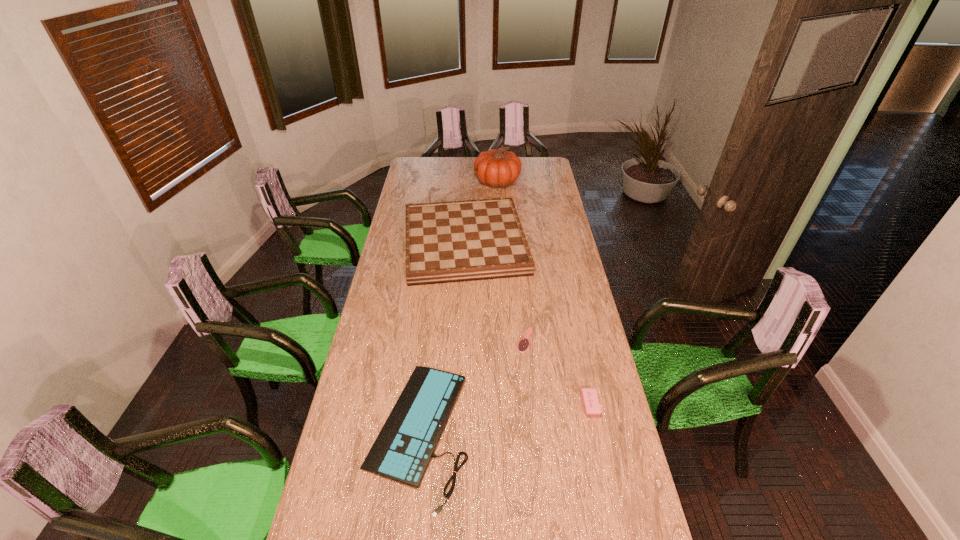
Find the location of a particular element. vacant space located on the face of the farthest object is located at coordinates (463, 181).

I want to click on free space located on the face of the farthest object, so click(410, 181).

I want to click on free space located 0.100m on the right of the second tallest object, so click(x=549, y=243).

You are a GUI agent. You are given a task and a screenshot of the screen. Output one action in this format:
    pyautogui.click(x=<x>, y=<y>)
    Task: Click on the vacant space positioned on the back of the eraser
    This screenshot has width=960, height=540.
    Given the screenshot: What is the action you would take?
    pyautogui.click(x=582, y=369)

Where is `vacant space located 0.330m on the back of the computer keyboard`? vacant space located 0.330m on the back of the computer keyboard is located at coordinates (433, 305).

The image size is (960, 540). Find the location of `vacant space situated on the left of the hairbrush`. vacant space situated on the left of the hairbrush is located at coordinates (473, 340).

The width and height of the screenshot is (960, 540). Find the location of `object present at the far edge`. object present at the far edge is located at coordinates (496, 168).

Locate an element on the screen. The image size is (960, 540). gameboard that is at the left edge is located at coordinates (457, 241).

You are a GUI agent. You are given a task and a screenshot of the screen. Output one action in this format:
    pyautogui.click(x=<x>, y=<y>)
    Task: Click on the computer keyboard situated at the left edge
    
    Given the screenshot: What is the action you would take?
    pyautogui.click(x=402, y=451)

At what (x,y) coordinates should I click in order to perform the action: click on object present at the right edge. Please return your answer as a coordinate pair (x, y). The width and height of the screenshot is (960, 540). Looking at the image, I should click on (590, 401).